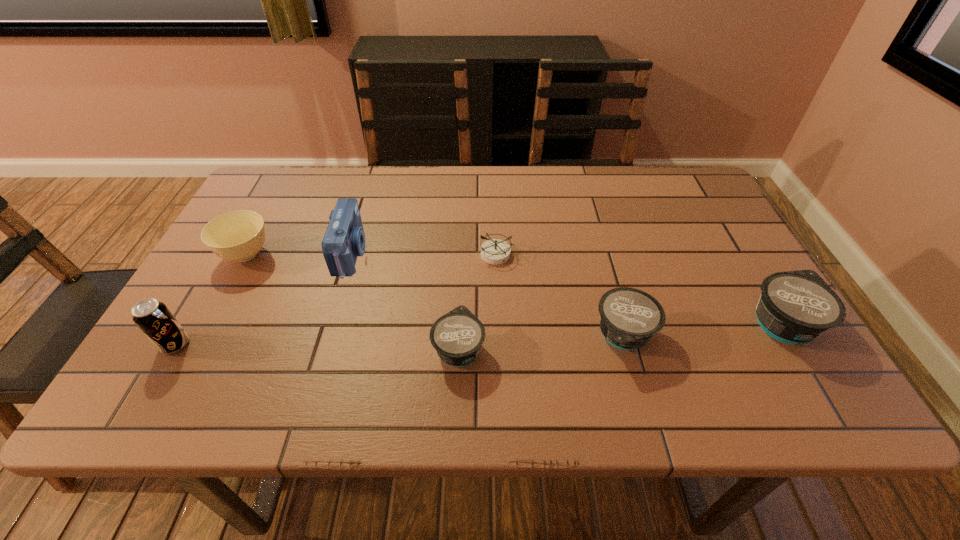
You are a GUI agent. You are given a task and a screenshot of the screen. Output one action in this format:
    pyautogui.click(x=<x>, y=<y>)
    Task: Click on the empty space between the fifth object from right to left and the soda can
    
    Given the screenshot: What is the action you would take?
    pyautogui.click(x=263, y=299)

I want to click on unoccupied area between the camera and the rightmost yogurt, so click(566, 288).

Where is `free spot between the shortest yogurt and the sugar bowl`? This screenshot has width=960, height=540. free spot between the shortest yogurt and the sugar bowl is located at coordinates (352, 301).

At what (x,y) coordinates should I click in order to perform the action: click on object that stands as the third closest to the leftmost yogurt. Please return your answer as a coordinate pair (x, y). Looking at the image, I should click on (344, 240).

This screenshot has width=960, height=540. What are the coordinates of `the fifth closest object to the soda can` in the screenshot? It's located at point(629,317).

Identify which yogurt is the nearest to the sugar bowl. Please provide its 2D coordinates. Your answer should be formatted as a tuple, i.e. [(x, y)], where the tuple contains the x and y coordinates of a point satisfying the conditions above.

[(457, 336)]

Identify which yogurt is located as the nearest to the fifth object from right to left. Please provide its 2D coordinates. Your answer should be formatted as a tuple, i.e. [(x, y)], where the tuple contains the x and y coordinates of a point satisfying the conditions above.

[(457, 336)]

Find the location of a particular element. This screenshot has width=960, height=540. blank area in the image that satisfies the following two spatial constraints: 1. on the lens of the camera; 2. on the left side of the shortest yogurt is located at coordinates (323, 348).

At what (x,y) coordinates should I click in order to perform the action: click on vacant region that satisfies the following two spatial constraints: 1. on the lens of the camera; 2. on the back side of the fifth tallest object. Please return your answer as a coordinate pair (x, y). The image size is (960, 540). Looking at the image, I should click on (326, 336).

You are a GUI agent. You are given a task and a screenshot of the screen. Output one action in this format:
    pyautogui.click(x=<x>, y=<y>)
    Task: Click on the vacant space that satisfies the following two spatial constraints: 1. on the lens of the camera; 2. on the right side of the shortest yogurt
    
    Given the screenshot: What is the action you would take?
    coord(323,348)